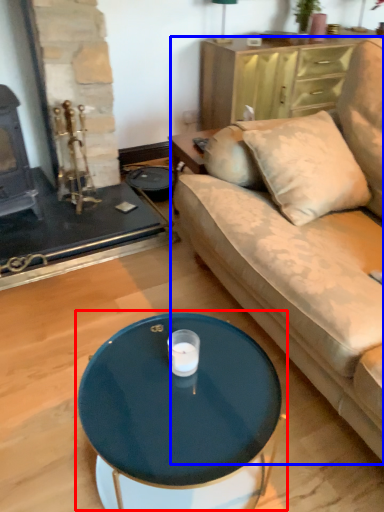
Question: Among these objects, which one is nearest to the camera, coffee table (highlighted by a red box) or studio couch (highlighted by a blue box)?

Choices:
 (A) coffee table
 (B) studio couch

Answer: (B)